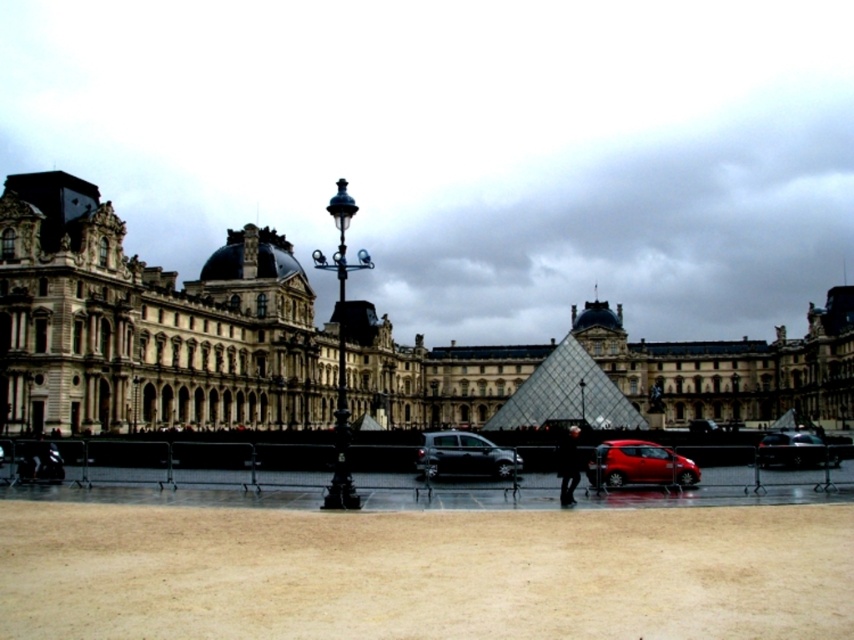
You are a tour guide leading a group to the entrance of the Louvre Museum. You have two shiny black cars available for transportation. The first is the shiny black car at center and the second is the shiny black car at right. If you need to choose one that is closer to the main entrance, which one should you choose?

The shiny black car at center is closer to the main entrance because it is positioned at the center, which is typically closer to the main entrance than the one at the right.

You are standing in front of the Louvre Museum and see a shiny red car at center and a dark fabric jacket at center. Which object is shorter in height?

The shiny red car at center has a lesser height compared to the dark fabric jacket at center, so the shiny red car at center is shorter.